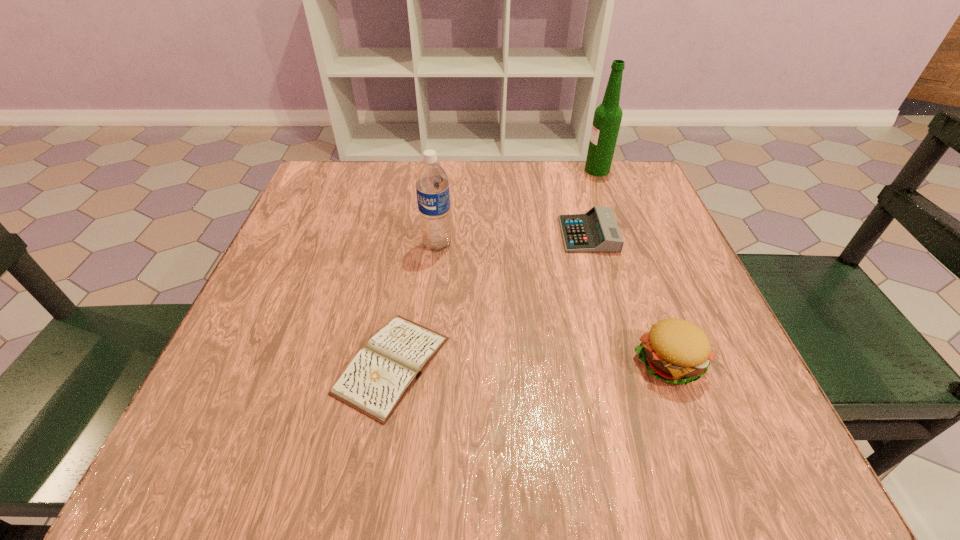
Locate an element on the screen. The width and height of the screenshot is (960, 540). vacant space situated on the front of the hamburger is located at coordinates (694, 428).

Locate an element on the screen. Image resolution: width=960 pixels, height=540 pixels. free region located 0.260m on the front of the fourth tallest object is located at coordinates (622, 356).

Where is `free space located on the back of the shortest object`? free space located on the back of the shortest object is located at coordinates (414, 238).

I want to click on object that is at the far edge, so click(607, 118).

Find the location of a particular element. The height and width of the screenshot is (540, 960). object present at the near edge is located at coordinates click(x=379, y=376).

The width and height of the screenshot is (960, 540). Identify the location of beer bottle situated at the right edge. (607, 118).

Locate an element on the screen. The width and height of the screenshot is (960, 540). hamburger present at the right edge is located at coordinates (676, 351).

What are the coordinates of `calculator at the right edge` in the screenshot? It's located at (595, 231).

The height and width of the screenshot is (540, 960). What are the coordinates of `object at the far right corner` in the screenshot? It's located at (607, 118).

Identify the location of free space at the far edge of the desktop. (375, 198).